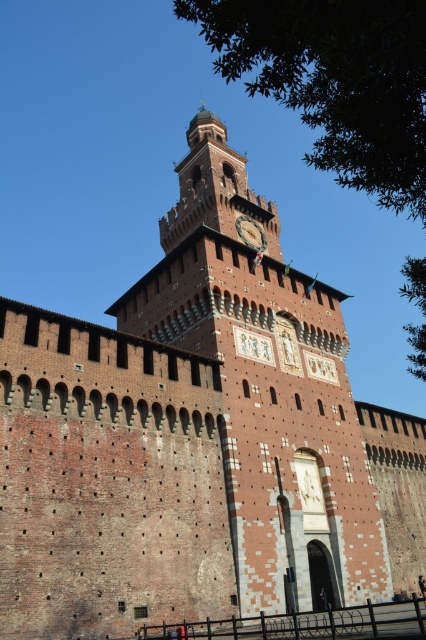
Is green leafy tree at upper right bigger than gold metallic clock at center?

Indeed, green leafy tree at upper right has a larger size compared to gold metallic clock at center.

Does green leafy tree at upper right appear over gold metallic clock at center?

Correct, green leafy tree at upper right is located above gold metallic clock at center.

Which is in front, point (417, 292) or point (249, 230)?

Point (417, 292) is more forward.

Locate an element on the screen. green leafy tree at upper right is located at coordinates (334, 81).